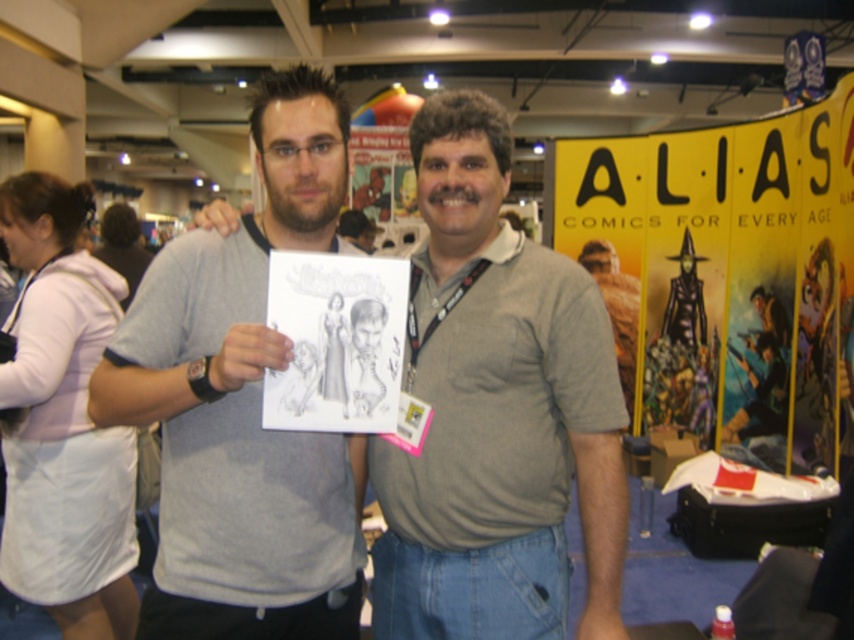
Question: Which object is positioned closest to the graphite paper drawing at center?

Choices:
 (A) yellow paper poster at upper right
 (B) gray cotton shirt at center
 (C) gray cotton t-shirt at center

Answer: (C)

Question: Can you confirm if gray cotton t-shirt at center is positioned below yellow paper poster at upper right?

Choices:
 (A) no
 (B) yes

Answer: (B)

Question: Is gray cotton t-shirt at center above yellow paper poster at upper right?

Choices:
 (A) no
 (B) yes

Answer: (A)

Question: Which point is farther to the camera?

Choices:
 (A) (527, 598)
 (B) (831, 426)
 (C) (338, 97)
 (D) (395, 291)

Answer: (B)

Question: Can you confirm if gray cotton shirt at center is wider than yellow paper poster at upper right?

Choices:
 (A) yes
 (B) no

Answer: (B)

Question: Which point appears closest to the camera in this image?

Choices:
 (A) [x=340, y=586]
 (B) [x=372, y=288]
 (C) [x=607, y=147]

Answer: (B)